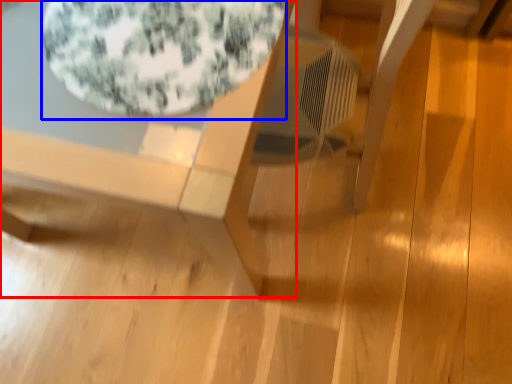
Question: Which of the following is the farthest to the observer, table (highlighted by a red box) or bean bag chair (highlighted by a blue box)?

Choices:
 (A) table
 (B) bean bag chair

Answer: (B)